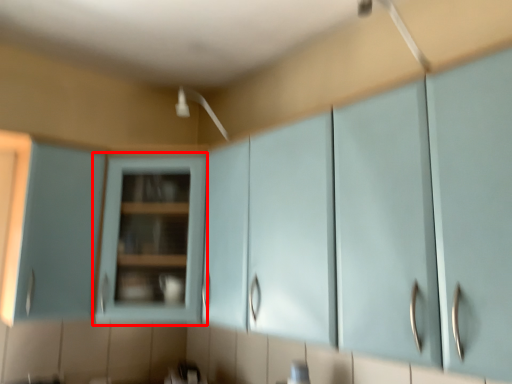
Question: Observing the image, what is the correct spatial positioning of cabinetry (annotated by the red box) in reference to cabinetry?

Choices:
 (A) left
 (B) right

Answer: (B)